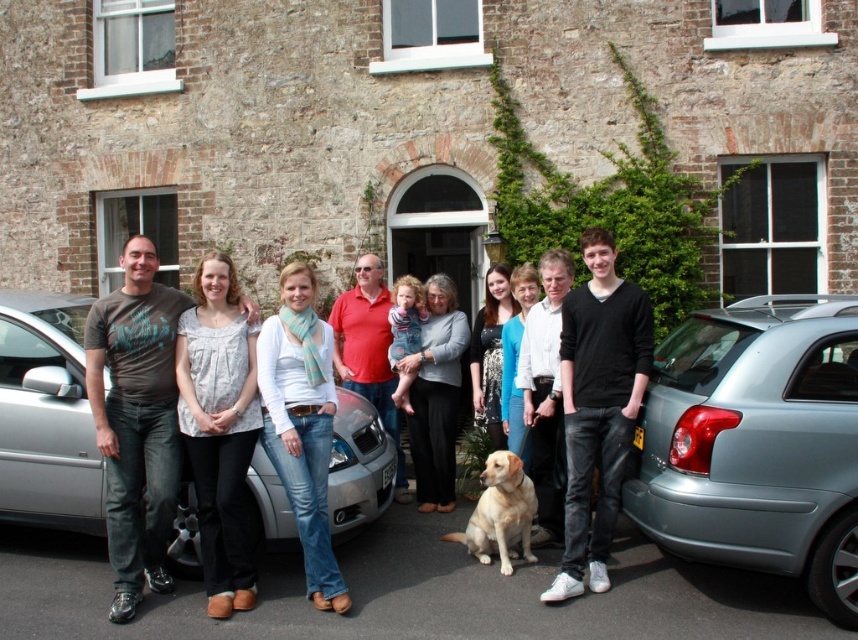
Question: Based on their relative distances, which object is farther from the silver metallic car at center?

Choices:
 (A) golden fur dog at center
 (B) denim jeans at center
 (C) light gray cotton blouse at center
 (D) matte gray sweater at center

Answer: (D)

Question: Considering the real-world distances, which object is farthest from the denim jeans at center?

Choices:
 (A) matte gray sweater at center
 (B) matte black t-shirt at center
 (C) light gray cotton blouse at center
 (D) golden fur dog at center

Answer: (A)

Question: Does silver metallic car at center have a smaller size compared to black cotton shirt at center?

Choices:
 (A) no
 (B) yes

Answer: (A)

Question: Does metallic gray hatchback at lower right have a smaller size compared to denim jeans at center?

Choices:
 (A) yes
 (B) no

Answer: (B)

Question: Which point is farther to the camera?

Choices:
 (A) golden fur dog at center
 (B) black cotton shirt at center
 (C) matte gray sweater at center
 (D) light gray cotton blouse at center

Answer: (C)

Question: Can you confirm if light gray cotton blouse at center is positioned to the right of matte black t-shirt at center?

Choices:
 (A) yes
 (B) no

Answer: (B)